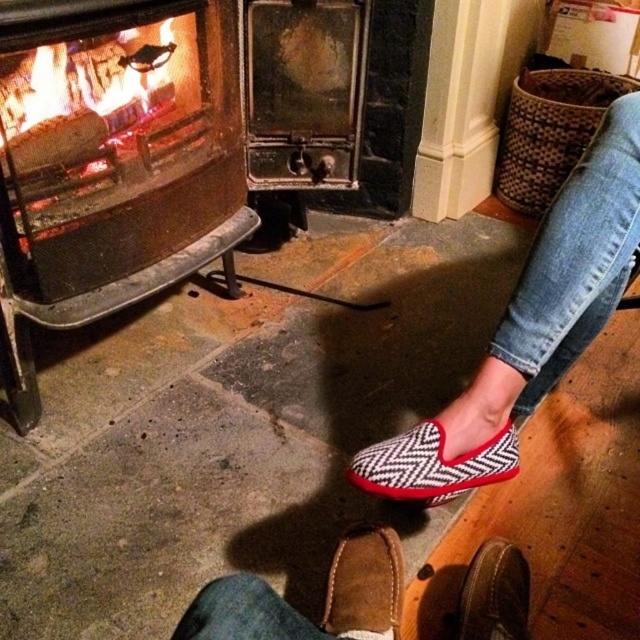
You are standing in front of the fireplace and see two points marked in the image. The first point is at coordinates point (408, 442) and the second point is at point (344, 563). Which point is nearer to you?

Point (408, 442) is closer to the camera than point (344, 563), so the first point is nearer to you.

You are standing in front of the fireplace and want to place a small decorative item between the two points marked as point (355, 627) and point (454, 634). Based on their positions, which point should the item be placed closer to in order to be nearer to the viewer?

The item should be placed closer to point (355, 627) because it is closer to the viewer than point (454, 634).